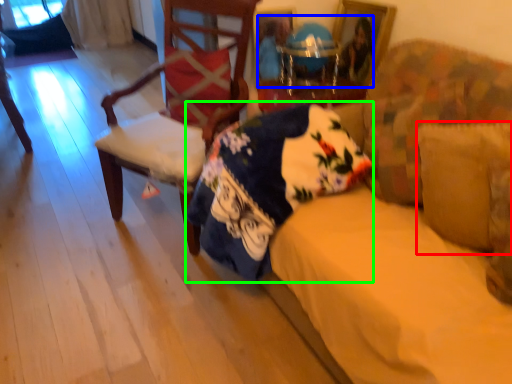
Question: Which object is the farthest from pillow (highlighted by a red box)? Choose among these: couple (highlighted by a blue box) or blanket (highlighted by a green box).

Choices:
 (A) couple
 (B) blanket

Answer: (A)